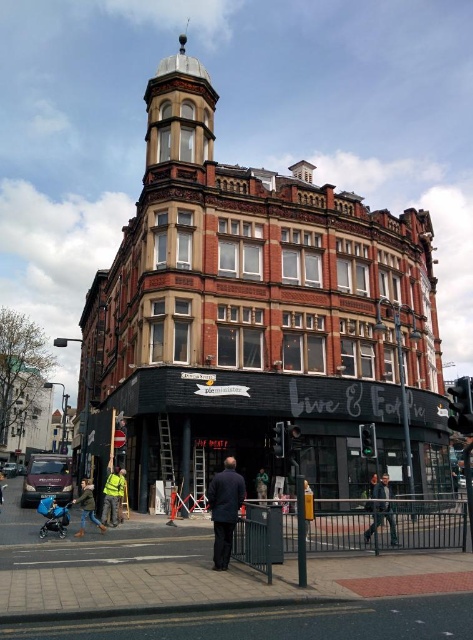
You are a pedestrian approaching the entrance of Pie Minister. You see a yellow reflective vest at lower left and a blue fabric baby carriage at lower left. Which object is closer to the entrance?

The yellow reflective vest at lower left is located above the blue fabric baby carriage at lower left, so the yellow reflective vest at lower left is closer to the entrance.